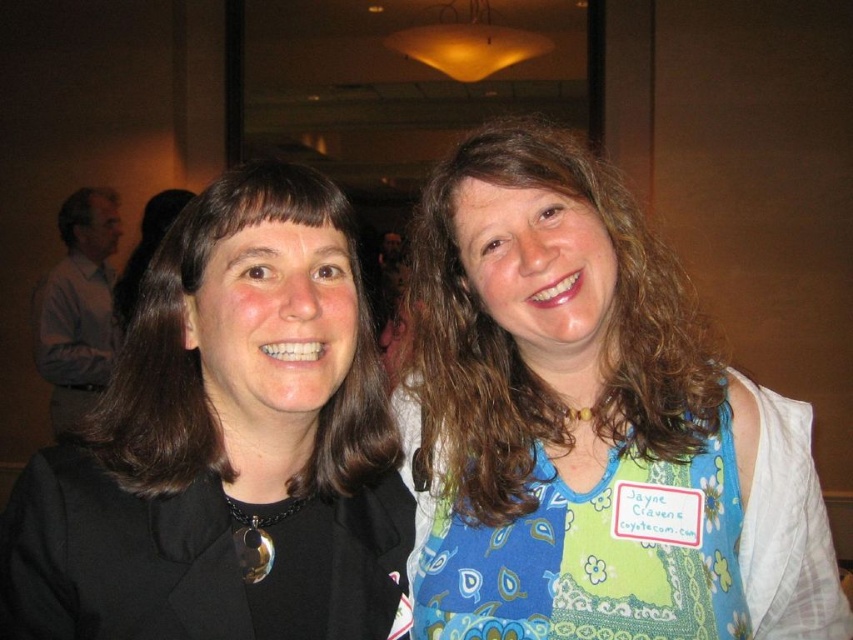
From the picture: Does blue floral dress at center appear on the right side of blue patchwork apron at right?

In fact, blue floral dress at center is to the left of blue patchwork apron at right.

Image resolution: width=853 pixels, height=640 pixels. What do you see at coordinates (589, 426) in the screenshot?
I see `blue floral dress at center` at bounding box center [589, 426].

Identify the location of blue floral dress at center. This screenshot has width=853, height=640. (589, 426).

Is point (340, 388) more distant than point (508, 616)?

Yes, it is behind point (508, 616).

Image resolution: width=853 pixels, height=640 pixels. What are the coordinates of `black fabric at left` in the screenshot? It's located at tap(224, 444).

Is blue floral dress at center to the left of black fabric at left from the viewer's perspective?

No, blue floral dress at center is not to the left of black fabric at left.

Can you confirm if blue floral dress at center is positioned to the right of black fabric at left?

Yes, blue floral dress at center is to the right of black fabric at left.

Locate an element on the screen. The width and height of the screenshot is (853, 640). blue floral dress at center is located at coordinates click(589, 426).